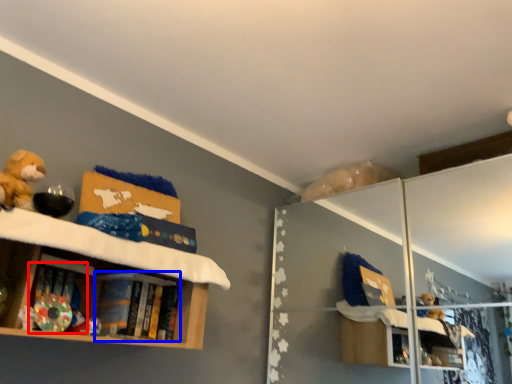
Question: Which of the following is the farthest to the observer, book (highlighted by a red box) or book (highlighted by a blue box)?

Choices:
 (A) book
 (B) book

Answer: (B)